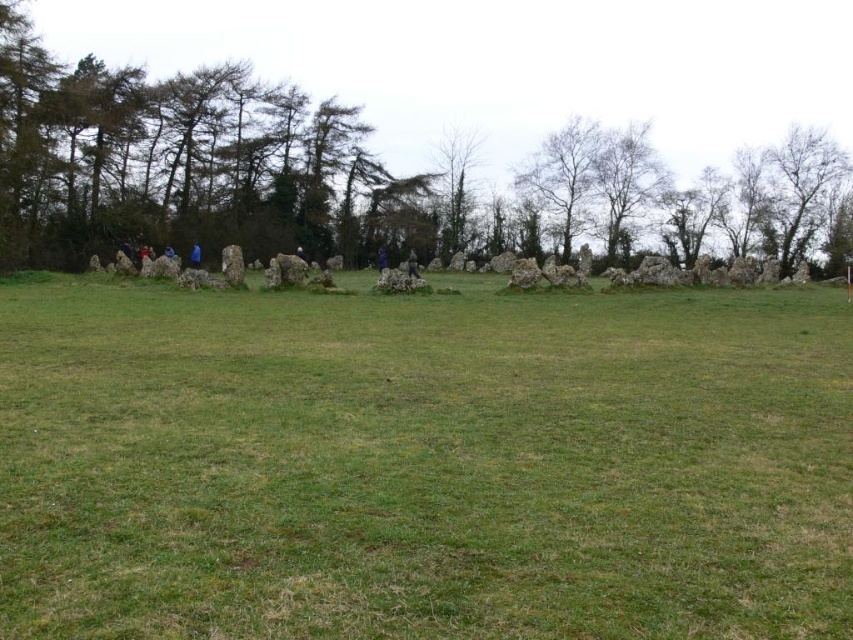
Can you confirm if green grassy field at center is thinner than bare wood tree at upper right?

In fact, green grassy field at center might be wider than bare wood tree at upper right.

Who is more forward, (190,403) or (801,134)?

Positioned in front is point (190,403).

Locate an element on the screen. green grassy field at center is located at coordinates 424,465.

Does green grassy field at center have a greater height compared to green leafy tree at upper center?

In fact, green grassy field at center may be shorter than green leafy tree at upper center.

Who is more forward, (369, 340) or (579, 134)?

Positioned in front is point (369, 340).

Image resolution: width=853 pixels, height=640 pixels. Identify the location of green grassy field at center. (424, 465).

Is point (192, 230) closer to camera compared to point (782, 180)?

Yes.

Which is in front, point (368, 104) or point (808, 136)?

Positioned in front is point (808, 136).

The image size is (853, 640). Identify the location of green leafy tree at upper center. (439, 141).